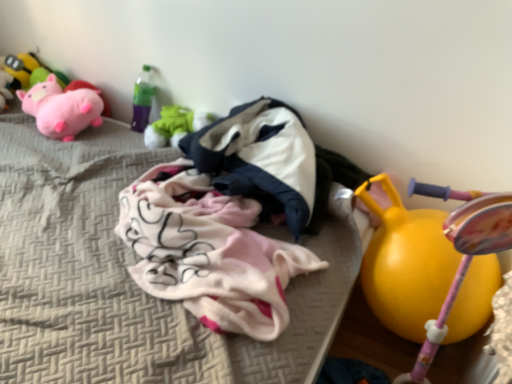
Question: Is matte yellow toy at upper left, which is counted as the 5th toy, starting from the right, to the left of white fabric at center from the viewer's perspective?

Choices:
 (A) no
 (B) yes

Answer: (B)

Question: Considering the relative sizes of matte yellow toy at upper left, which is counted as the 5th toy, starting from the right, and white fabric at center in the image provided, is matte yellow toy at upper left, which is counted as the 5th toy, starting from the right, wider than white fabric at center?

Choices:
 (A) yes
 (B) no

Answer: (B)

Question: Is matte yellow toy at upper left, arranged as the first toy when viewed from the left, bigger than white fabric at center?

Choices:
 (A) no
 (B) yes

Answer: (A)

Question: Can you confirm if matte yellow toy at upper left, which is counted as the 5th toy, starting from the right, is smaller than white fabric at center?

Choices:
 (A) no
 (B) yes

Answer: (B)

Question: Does matte yellow toy at upper left, arranged as the first toy when viewed from the left, have a lesser width compared to white fabric at center?

Choices:
 (A) no
 (B) yes

Answer: (B)

Question: From a real-world perspective, is white cotton hoodie at center positioned above or below matte green plush toy at upper left, marked as the 2th toy in a right-to-left arrangement?

Choices:
 (A) above
 (B) below

Answer: (A)

Question: Which is correct: white cotton hoodie at center is inside matte green plush toy at upper left, which appears as the fourth toy when viewed from the left, or outside of it?

Choices:
 (A) outside
 (B) inside

Answer: (A)

Question: Considering the positions of white cotton hoodie at center and matte green plush toy at upper left, marked as the 2th toy in a right-to-left arrangement, in the image, is white cotton hoodie at center taller or shorter than matte green plush toy at upper left, marked as the 2th toy in a right-to-left arrangement,?

Choices:
 (A) short
 (B) tall

Answer: (B)

Question: Is point (218, 127) closer or farther from the camera than point (187, 124)?

Choices:
 (A) closer
 (B) farther

Answer: (A)

Question: In the image, is matte pink plush at upper left, which ranks as the 3th toy in right-to-left order, positioned in front of or behind white fabric at center?

Choices:
 (A) behind
 (B) front

Answer: (A)

Question: Choose the correct answer: Is matte pink plush at upper left, which ranks as the 3th toy in right-to-left order, inside white fabric at center or outside it?

Choices:
 (A) outside
 (B) inside

Answer: (A)

Question: Is matte pink plush at upper left, the third toy from the left, wider or thinner than white fabric at center?

Choices:
 (A) wide
 (B) thin

Answer: (B)

Question: Is point (47, 92) closer or farther from the camera than point (169, 337)?

Choices:
 (A) closer
 (B) farther

Answer: (B)

Question: Looking at their shapes, would you say white cotton hoodie at center is wider or thinner than matte pink plush at upper left, which ranks as the 3th toy in right-to-left order?

Choices:
 (A) thin
 (B) wide

Answer: (B)

Question: Does point click(x=199, y=170) appear closer or farther from the camera than point click(x=35, y=97)?

Choices:
 (A) farther
 (B) closer

Answer: (B)